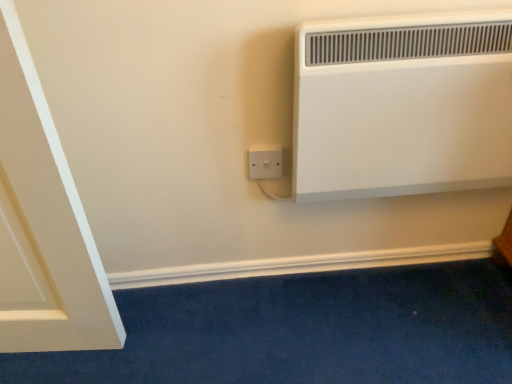
Question: Does white plastic socket at lower center have a lesser height compared to white matte heater at upper right?

Choices:
 (A) yes
 (B) no

Answer: (A)

Question: Is white plastic socket at lower center positioned behind white matte heater at upper right?

Choices:
 (A) yes
 (B) no

Answer: (A)

Question: Would you say white plastic socket at lower center is outside white matte heater at upper right?

Choices:
 (A) yes
 (B) no

Answer: (A)

Question: Would you consider white plastic socket at lower center to be distant from white matte heater at upper right?

Choices:
 (A) yes
 (B) no

Answer: (B)

Question: Could you tell me if white plastic socket at lower center is turned towards white matte heater at upper right?

Choices:
 (A) yes
 (B) no

Answer: (B)

Question: From a real-world perspective, is white plastic socket at lower center over white matte heater at upper right?

Choices:
 (A) no
 (B) yes

Answer: (A)

Question: Can you confirm if white matte heater at upper right is bigger than white plastic socket at lower center?

Choices:
 (A) yes
 (B) no

Answer: (A)

Question: Does white matte heater at upper right lie behind white plastic socket at lower center?

Choices:
 (A) yes
 (B) no

Answer: (B)

Question: Can you confirm if white matte heater at upper right is thinner than white plastic socket at lower center?

Choices:
 (A) no
 (B) yes

Answer: (A)

Question: Are white matte heater at upper right and white plastic socket at lower center making contact?

Choices:
 (A) yes
 (B) no

Answer: (B)

Question: Does white matte heater at upper right contain white plastic socket at lower center?

Choices:
 (A) yes
 (B) no

Answer: (B)

Question: Could you tell me if white matte heater at upper right is turned towards white plastic socket at lower center?

Choices:
 (A) no
 (B) yes

Answer: (A)

Question: From the image's perspective, relative to white plastic socket at lower center, is white matte heater at upper right above or below?

Choices:
 (A) above
 (B) below

Answer: (A)